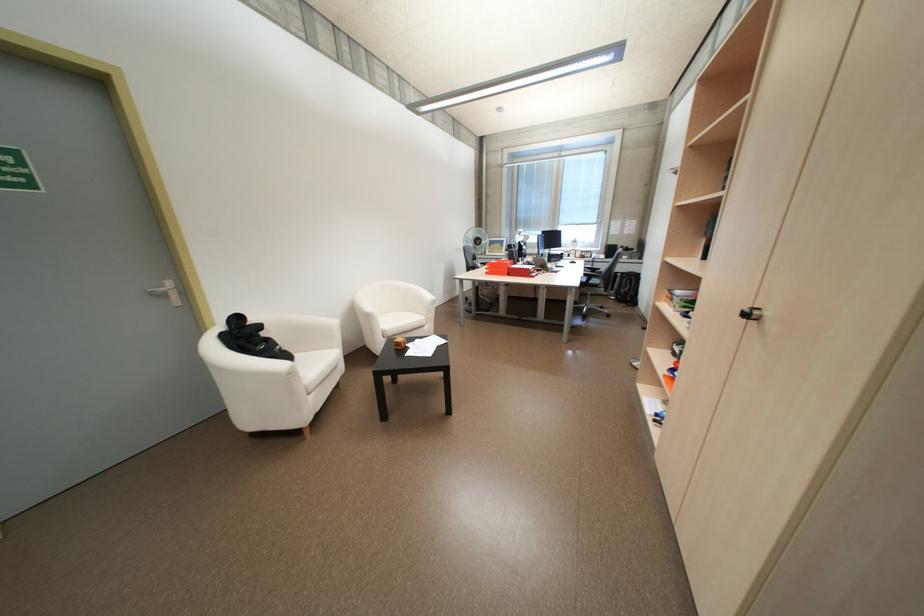
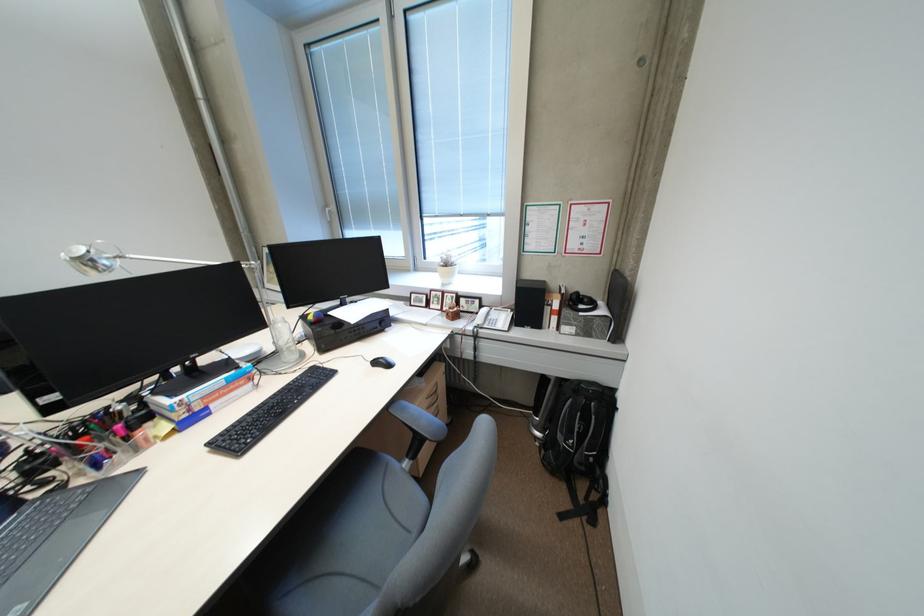
Find the pixel in the second image that matches the point at 621,251 in the first image.

(538, 302)